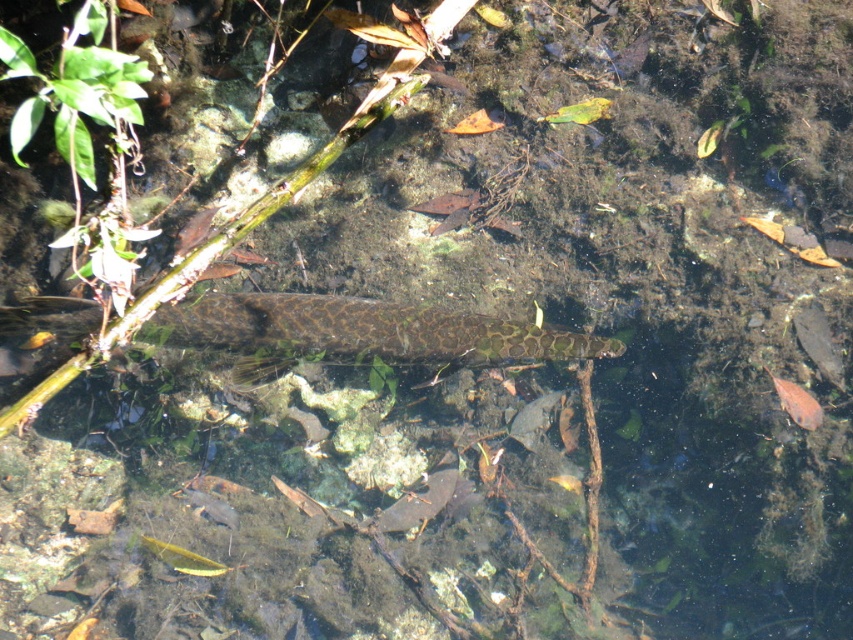
You are a fisherman who wants to catch the translucent orange fish at lower right without disturbing the green textured snake at center. Based on their sizes, which one do you think is easier to catch?

The translucent orange fish at lower right is easier to catch because it is smaller than the green textured snake at center.

You are an aquatic creature swimming in the shallow water. You see the green textured snake at center and the translucent orange fish at lower right. Which one can you easily avoid by moving sideways?

The translucent orange fish at lower right is smaller in size than the green textured snake at center, so you can easily avoid it by moving sideways.

You are standing at the edge of the water and see the green textured snake at center and the translucent orange fish at lower right. Which one appears closer to you?

The green textured snake at center is closer to the viewer than the translucent orange fish at lower right.